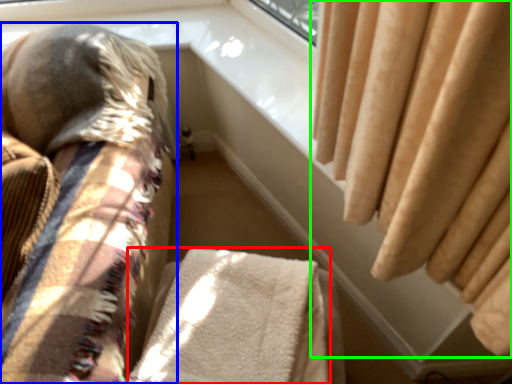
Question: Which is nearer to the blanket (highlighted by a red box)? furniture (highlighted by a blue box) or curtain (highlighted by a green box).

Choices:
 (A) furniture
 (B) curtain

Answer: (A)